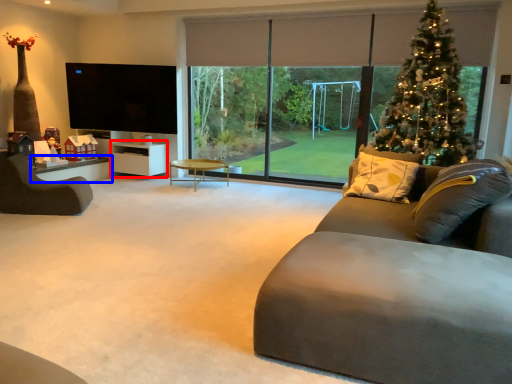
Question: Among these objects, which one is nearest to the camera, entertainment center (highlighted by a red box) or table (highlighted by a blue box)?

Choices:
 (A) entertainment center
 (B) table

Answer: (B)